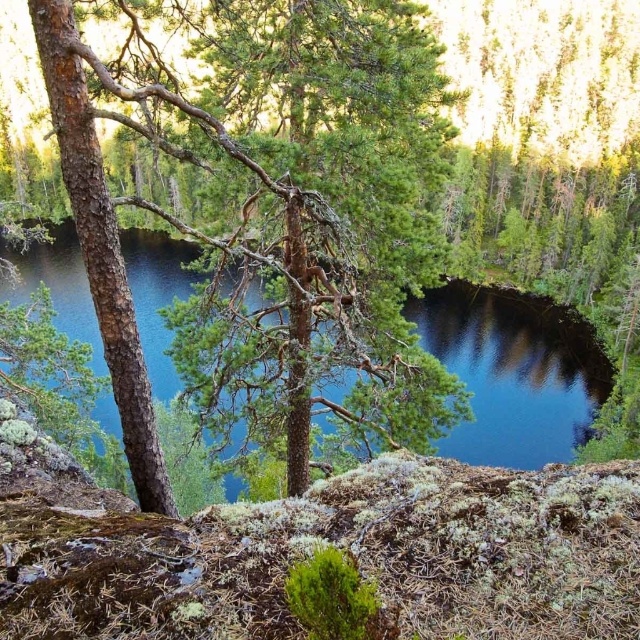
Question: Is green rough bark tree at center thinner than blue water at center?

Choices:
 (A) yes
 (B) no

Answer: (A)

Question: Which point is farther from the camera taking this photo?

Choices:
 (A) (145, 438)
 (B) (483, 305)

Answer: (B)

Question: Can you confirm if green rough bark tree at center is thinner than blue water at center?

Choices:
 (A) yes
 (B) no

Answer: (A)

Question: Does green rough bark tree at center have a greater width compared to blue water at center?

Choices:
 (A) yes
 (B) no

Answer: (B)